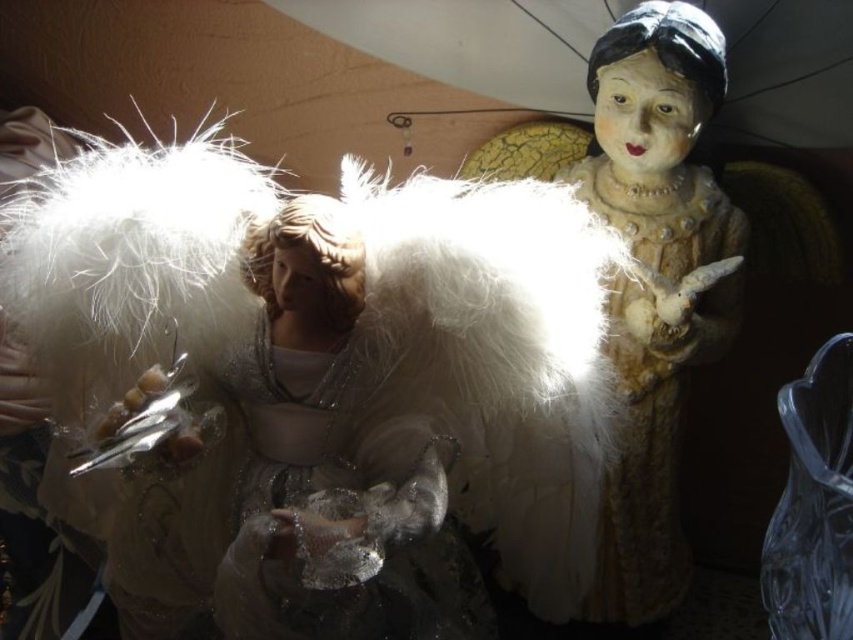
You are setting up a shelf for holiday decorations and have two items to place side by side. You have a satin white angel at center and a matte beige statue at center. Given their sizes, which one should you place first to ensure they both fit on the shelf?

The satin white angel at center is wider than the matte beige statue at center, so you should place the wider satin white angel at center first to accommodate its larger width before placing the matte beige statue at center.

You are setting up a display and want to arrange the satin white angel at center and the matte beige statue at center on a shelf. The shelf has a height limit of 15 inches. If the taller object is 14 inches tall, will both items fit on the shelf without exceeding the height limit?

The satin white angel at center is not as tall as the matte beige statue at center. Since the taller object is 14 inches tall, which is under the 15 inch limit, both items will fit on the shelf without exceeding the height limit.